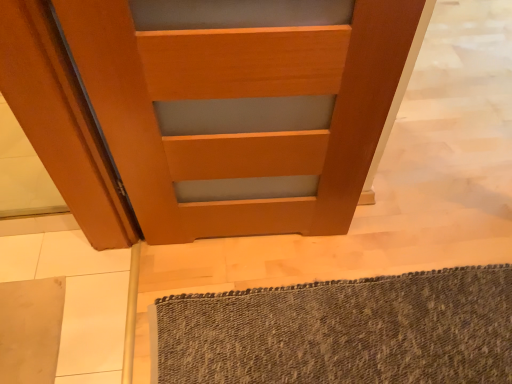
At what (x,y) coordinates should I click in order to perform the action: click on vacant space in front of wooden door at center. Please return your answer as a coordinate pair (x, y). The width and height of the screenshot is (512, 384). Looking at the image, I should click on (234, 274).